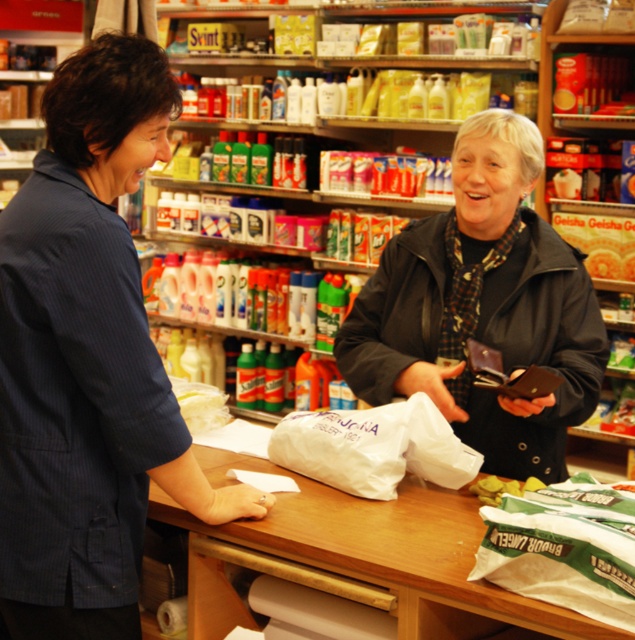
Question: Does blue striped shirt at left appear under white matte grocery bag at center?

Choices:
 (A) yes
 (B) no

Answer: (B)

Question: Is blue striped shirt at left closer to camera compared to white matte grocery bag at center?

Choices:
 (A) no
 (B) yes

Answer: (B)

Question: Does blue striped shirt at left have a greater width compared to dark blue jacket at center?

Choices:
 (A) no
 (B) yes

Answer: (A)

Question: Which of the following is the closest to the observer?

Choices:
 (A) (472, 243)
 (B) (364, 413)
 (C) (144, 500)

Answer: (C)

Question: Which point appears closest to the camera in this image?

Choices:
 (A) (328, 433)
 (B) (370, 337)
 (C) (18, 444)

Answer: (C)

Question: Which point is farther from the camera taking this photo?

Choices:
 (A) (373, 412)
 (B) (451, 288)

Answer: (B)